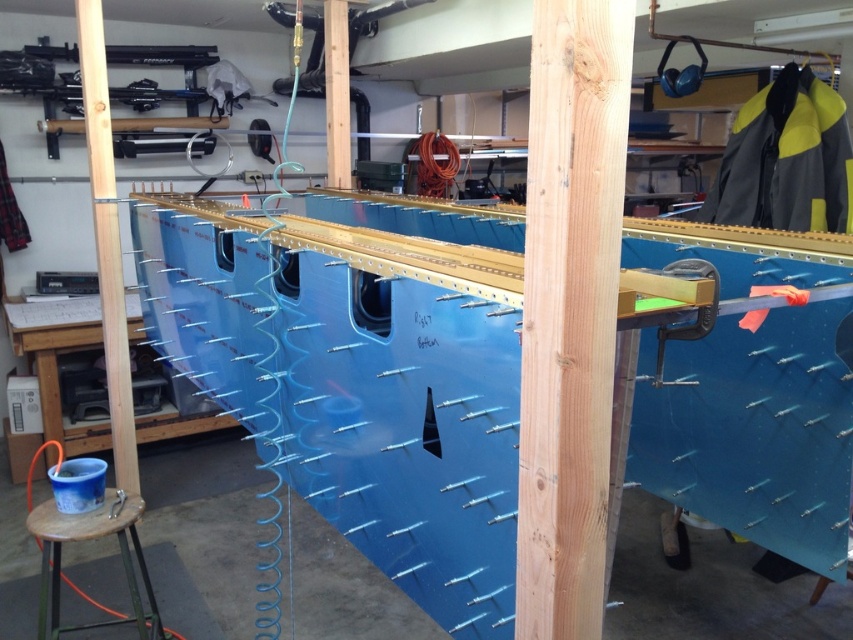
You are a technician in the workshop. You need to locate the point at coordinates point (x=570, y=310). Where is this point located in relation to the wooden beams supporting the blue metallic structure?

The point (x=570, y=310) is located on the natural wood beam at center, which is one of the wooden beams supporting the blue metallic structure.

You are a worker in the workshop and need to move a heavy tool from the natural wood beam at center to the brown wooden stool at lower left. Which object is closer to you to place the tool?

The natural wood beam at center is closer to the viewer than the brown wooden stool at lower left, so you should place the tool on the natural wood beam at center first since it is nearer.